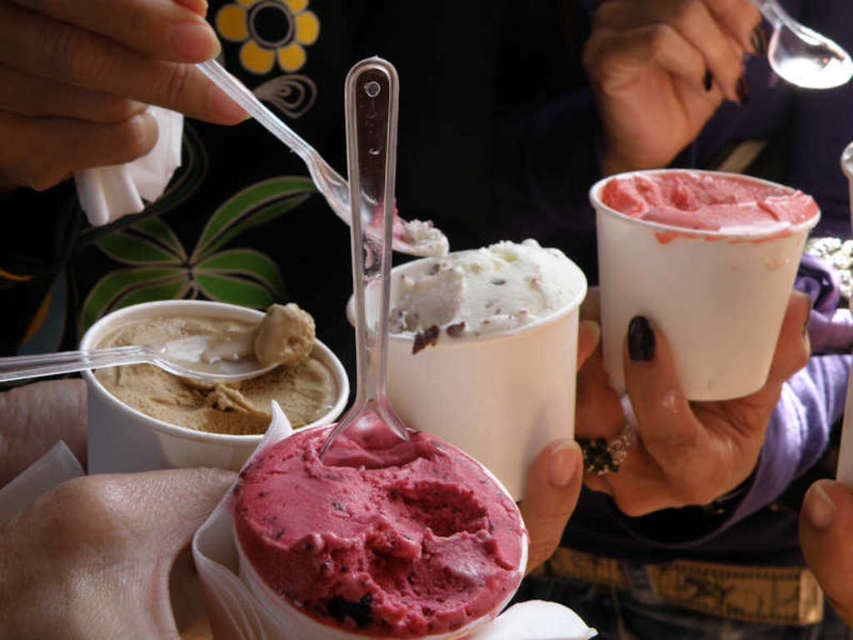
You are a customer at an ice cream shop and see the berry smoothie cup at center and the nail polish at upper center on the counter. Which item is shorter?

The berry smoothie cup at center is not as tall as the nail polish at upper center, so the berry smoothie cup at center is shorter.

You have a matte plastic spoon at upper left and a smooth beige ice cream at lower left. Which object is wider?

The matte plastic spoon at upper left is wider than the smooth beige ice cream at lower left.